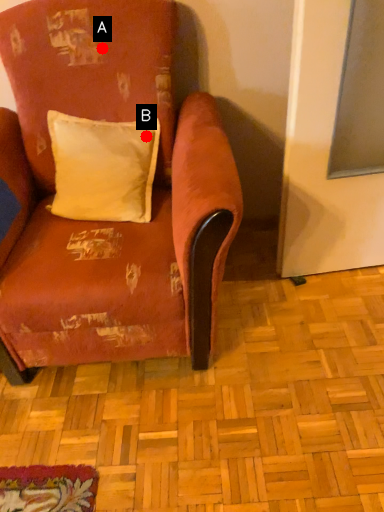
Question: Two points are circled on the image, labeled by A and B beside each circle. Which of the following is the closest to the observer?

Choices:
 (A) A is closer
 (B) B is closer

Answer: (A)